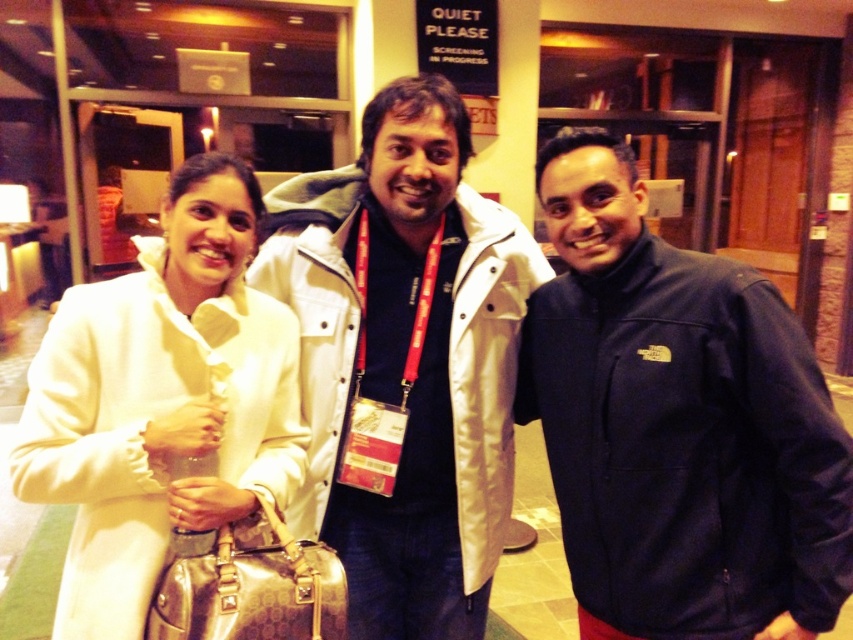
Question: Is dark blue fleece jacket at center further to the viewer compared to white leather jacket at center?

Choices:
 (A) yes
 (B) no

Answer: (A)

Question: Which object is positioned closest to the white matte jacket at center?

Choices:
 (A) dark blue fleece jacket at center
 (B) white leather jacket at center

Answer: (B)

Question: Based on their relative distances, which object is farther from the dark blue fleece jacket at center?

Choices:
 (A) white matte jacket at center
 (B) white leather jacket at center

Answer: (B)

Question: Does dark blue fleece jacket at center appear under white leather jacket at center?

Choices:
 (A) no
 (B) yes

Answer: (B)

Question: Is dark blue fleece jacket at center further to the viewer compared to white leather jacket at center?

Choices:
 (A) yes
 (B) no

Answer: (A)

Question: Which point is closer to the camera taking this photo?

Choices:
 (A) (45, 496)
 (B) (311, 352)

Answer: (A)